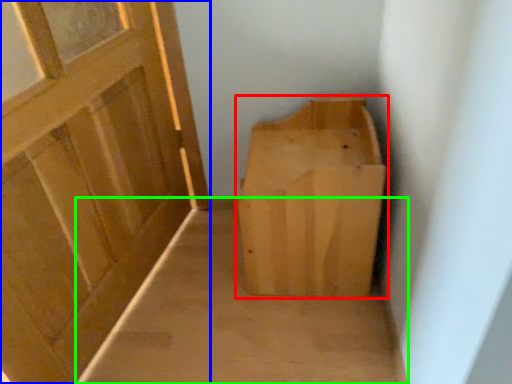
Question: Based on their relative distances, which object is farther from furniture (highlighted by a red box)? Choose from door (highlighted by a blue box) and plain (highlighted by a green box).

Choices:
 (A) door
 (B) plain

Answer: (A)